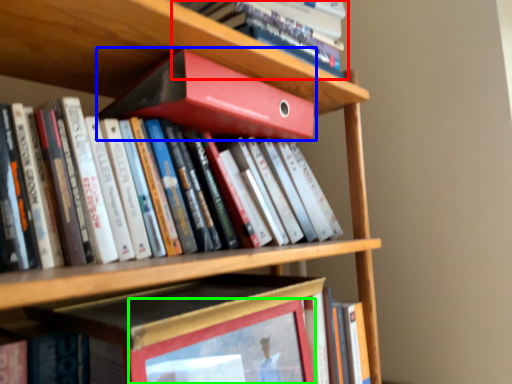
Question: Considering the real-world distances, which object is closest to book (highlighted by a red box)? book (highlighted by a blue box) or picture frame (highlighted by a green box).

Choices:
 (A) book
 (B) picture frame

Answer: (A)